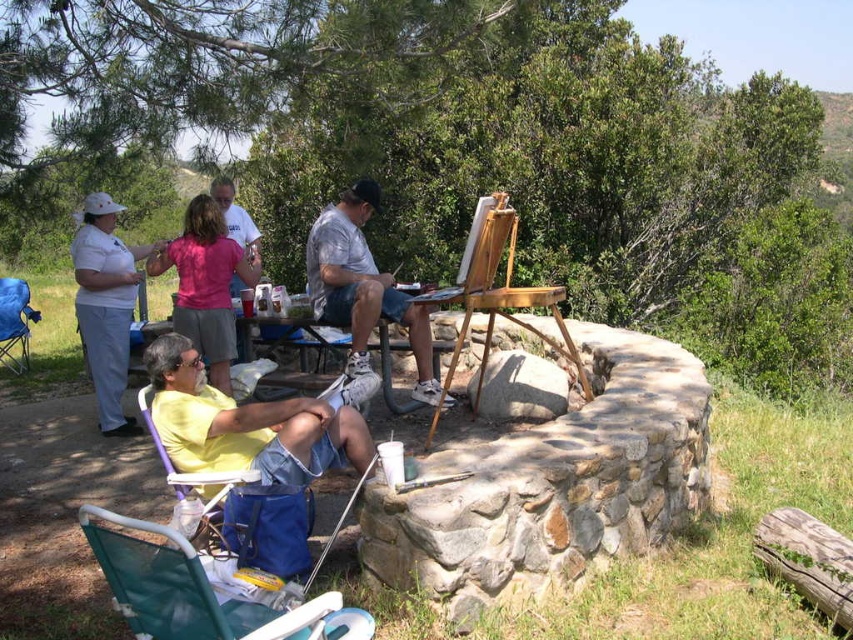
Can you confirm if green fabric folding chair at lower left is positioned below blue fabric chair at lower left?

Yes, green fabric folding chair at lower left is below blue fabric chair at lower left.

Which is behind, point (151, 618) or point (4, 282)?

The point (4, 282) is more distant.

Find the location of a particular element. green fabric folding chair at lower left is located at coordinates (199, 592).

Can you confirm if matte gray shirt at center is positioned below blue fabric chair at lower left?

Incorrect, matte gray shirt at center is not positioned below blue fabric chair at lower left.

Who is lower down, matte gray shirt at center or blue fabric chair at lower left?

blue fabric chair at lower left is lower down.

Does point (425, 384) come in front of point (7, 337)?

Yes, point (425, 384) is in front of point (7, 337).

The width and height of the screenshot is (853, 640). I want to click on matte gray shirt at center, so click(363, 289).

Who is shorter, wooden easel at center or purple plastic chair at lower left?

With less height is purple plastic chair at lower left.

Looking at this image, is wooden easel at center positioned in front of purple plastic chair at lower left?

That is False.

Where is `wooden easel at center`? wooden easel at center is located at coordinates (498, 289).